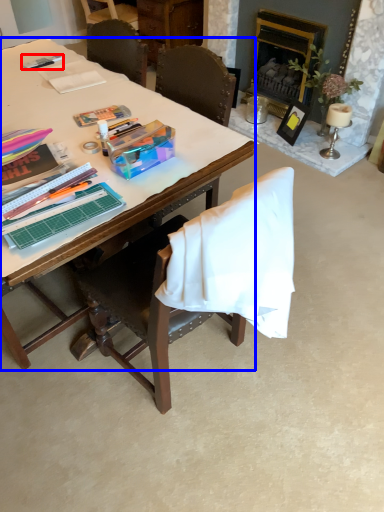
Question: Which object is further to the camera taking this photo, pen (highlighted by a red box) or desk (highlighted by a blue box)?

Choices:
 (A) pen
 (B) desk

Answer: (A)